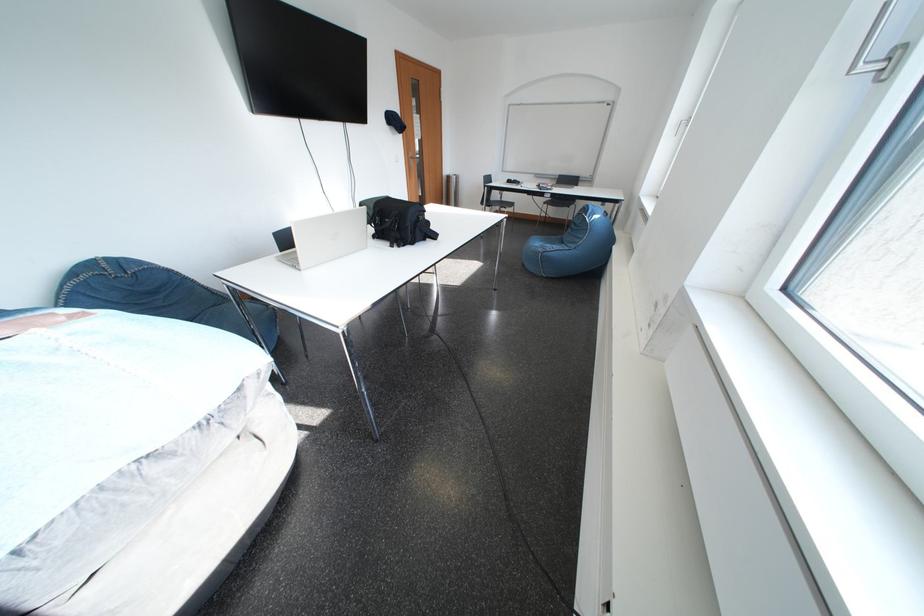
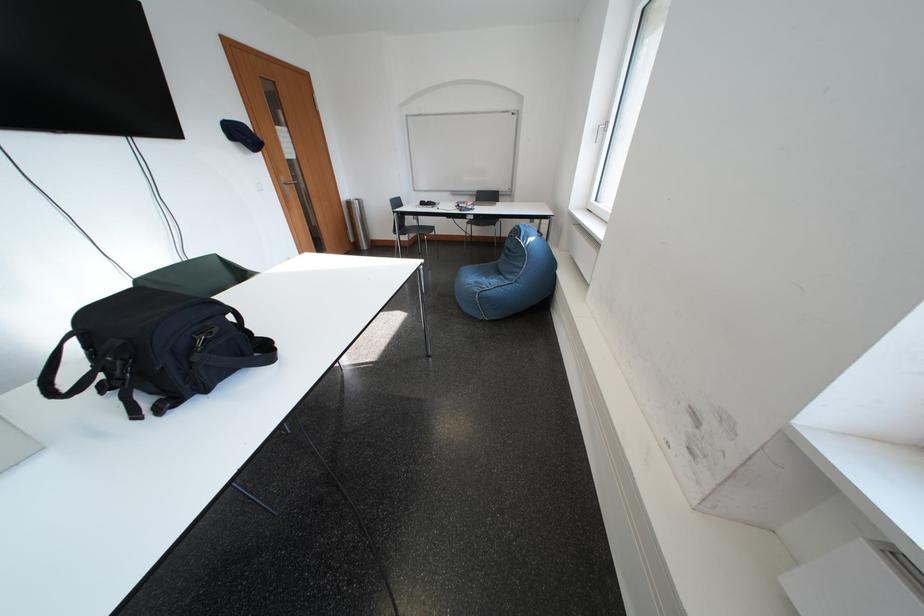
Locate, in the second image, the point that corresponds to point 459,180 in the first image.

(360, 207)